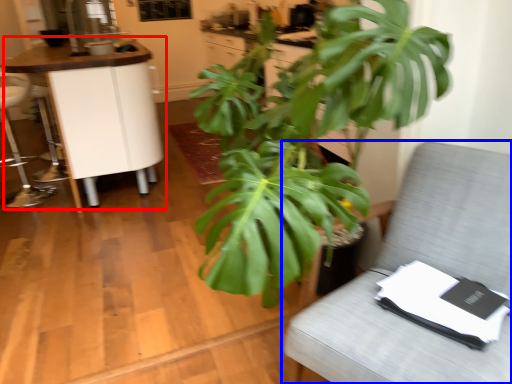
Question: Which object is further to the camera taking this photo, table (highlighted by a red box) or furniture (highlighted by a blue box)?

Choices:
 (A) table
 (B) furniture

Answer: (A)